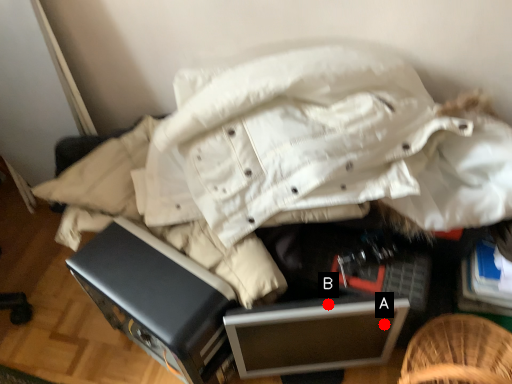
Question: Two points are circled on the image, labeled by A and B beside each circle. Which point is closer to the camera?

Choices:
 (A) A is closer
 (B) B is closer

Answer: (B)